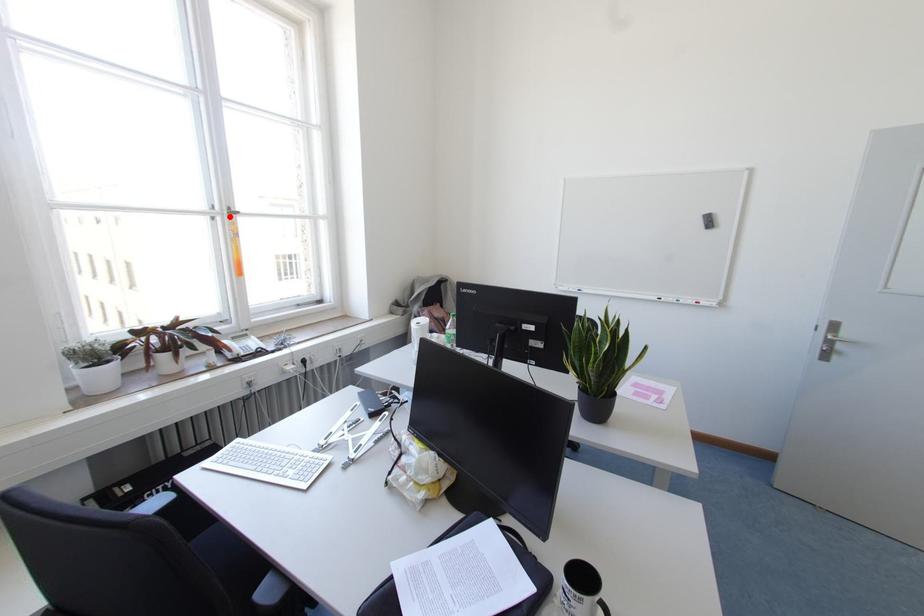
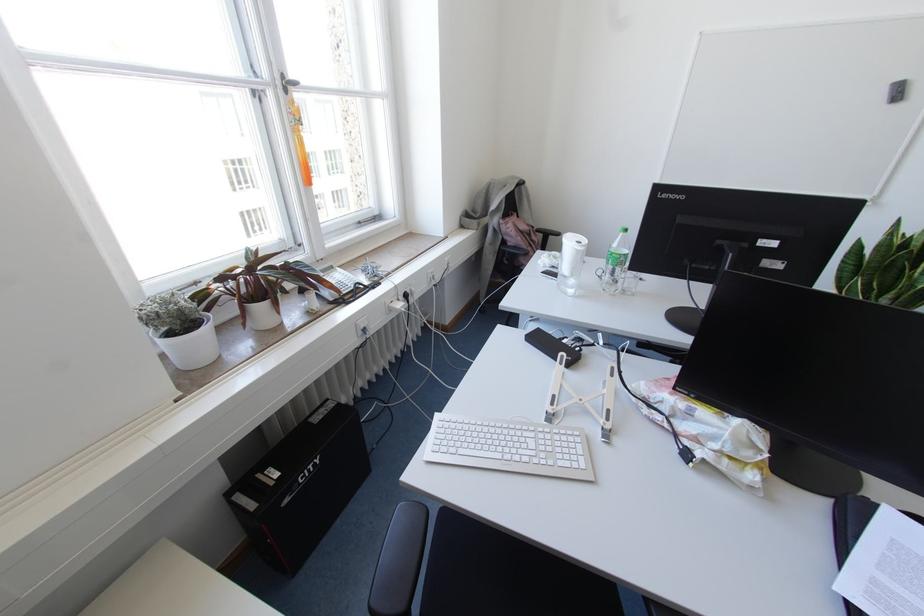
Locate, in the second image, the point that corresponds to the highlighted location in the first image.

(285, 90)